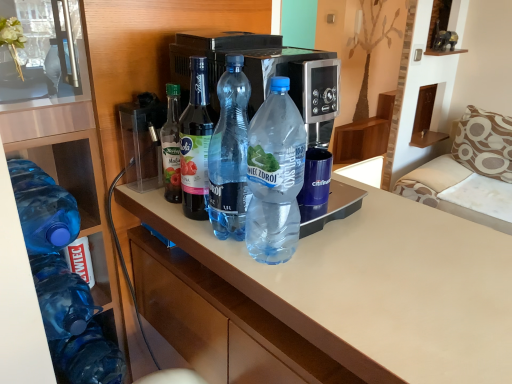
Locate an element on the screen. This screenshot has width=512, height=384. vacant area that lies in front of transparent plastic container at upper left is located at coordinates (157, 211).